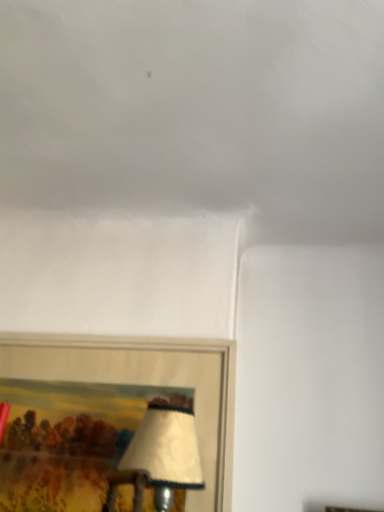
Question: Is wooden picture frame at lower left positioned before white matte cloud at upper center?

Choices:
 (A) no
 (B) yes

Answer: (A)

Question: Is wooden picture frame at lower left oriented towards white matte cloud at upper center?

Choices:
 (A) no
 (B) yes

Answer: (A)

Question: From a real-world perspective, is wooden picture frame at lower left located higher than white matte cloud at upper center?

Choices:
 (A) no
 (B) yes

Answer: (A)

Question: Is wooden picture frame at lower left far away from white matte cloud at upper center?

Choices:
 (A) no
 (B) yes

Answer: (A)

Question: Is wooden picture frame at lower left behind white matte cloud at upper center?

Choices:
 (A) yes
 (B) no

Answer: (A)

Question: Is wooden picture frame at lower left oriented away from white matte cloud at upper center?

Choices:
 (A) yes
 (B) no

Answer: (B)

Question: Is white matte cloud at upper center to the right of wooden picture frame at lower left from the viewer's perspective?

Choices:
 (A) yes
 (B) no

Answer: (A)

Question: Considering the relative sizes of white matte cloud at upper center and wooden picture frame at lower left in the image provided, is white matte cloud at upper center wider than wooden picture frame at lower left?

Choices:
 (A) no
 (B) yes

Answer: (B)

Question: Does white matte cloud at upper center touch wooden picture frame at lower left?

Choices:
 (A) yes
 (B) no

Answer: (B)

Question: Considering the relative sizes of white matte cloud at upper center and wooden picture frame at lower left in the image provided, is white matte cloud at upper center shorter than wooden picture frame at lower left?

Choices:
 (A) no
 (B) yes

Answer: (B)

Question: From the image's perspective, does white matte cloud at upper center appear higher than wooden picture frame at lower left?

Choices:
 (A) yes
 (B) no

Answer: (A)

Question: Is white matte cloud at upper center thinner than wooden picture frame at lower left?

Choices:
 (A) yes
 (B) no

Answer: (B)

Question: From their relative heights in the image, would you say white matte cloud at upper center is taller or shorter than wooden picture frame at lower left?

Choices:
 (A) tall
 (B) short

Answer: (B)